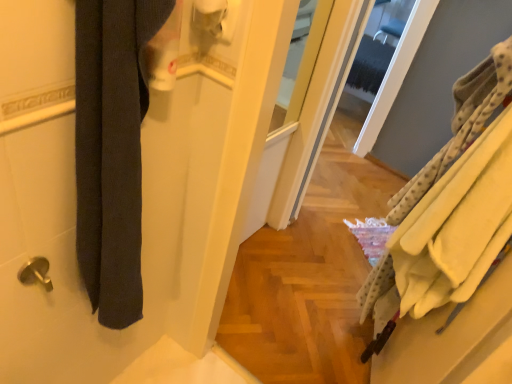
Question: Looking at the image, does dark gray fabric at left, marked as the 1th bath towel in a left-to-right arrangement, seem bigger or smaller compared to white matte toilet paper at upper center?

Choices:
 (A) big
 (B) small

Answer: (A)

Question: In the image, is dark gray fabric at left, marked as the second bath towel in a right-to-left arrangement, positioned in front of or behind white matte toilet paper at upper center?

Choices:
 (A) front
 (B) behind

Answer: (A)

Question: Which is farther from the white matte toilet paper at upper center?

Choices:
 (A) yellow fleece bath towel at right, arranged as the first bath towel when viewed from the right
 (B) dark gray fabric at left, marked as the 1th bath towel in a left-to-right arrangement

Answer: (A)

Question: Estimate the real-world distances between objects in this image. Which object is closer to the yellow fleece bath towel at right, arranged as the first bath towel when viewed from the right?

Choices:
 (A) dark gray fabric at left, marked as the 1th bath towel in a left-to-right arrangement
 (B) white matte toilet paper at upper center

Answer: (B)